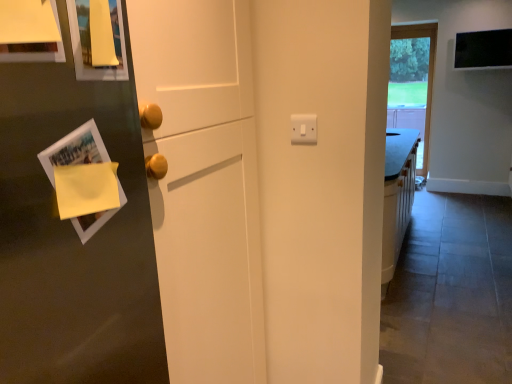
Question: Does yellow paper at left have a lesser width compared to transparent glass window at upper right?

Choices:
 (A) no
 (B) yes

Answer: (A)

Question: From the image's perspective, would you say yellow paper at left is shown under transparent glass window at upper right?

Choices:
 (A) no
 (B) yes

Answer: (B)

Question: Does yellow paper at left have a greater height compared to transparent glass window at upper right?

Choices:
 (A) no
 (B) yes

Answer: (A)

Question: From a real-world perspective, is yellow paper at left located beneath transparent glass window at upper right?

Choices:
 (A) no
 (B) yes

Answer: (A)

Question: From the image's perspective, would you say yellow paper at left is positioned over transparent glass window at upper right?

Choices:
 (A) no
 (B) yes

Answer: (A)

Question: Is there a large distance between yellow paper at left and transparent glass window at upper right?

Choices:
 (A) yes
 (B) no

Answer: (A)

Question: Is transparent glass window at upper right looking in the opposite direction of yellow paper at left?

Choices:
 (A) no
 (B) yes

Answer: (A)

Question: Is transparent glass window at upper right with yellow paper at left?

Choices:
 (A) no
 (B) yes

Answer: (A)

Question: From the image's perspective, is transparent glass window at upper right on top of yellow paper at left?

Choices:
 (A) yes
 (B) no

Answer: (A)

Question: Is transparent glass window at upper right at the left side of yellow paper at left?

Choices:
 (A) yes
 (B) no

Answer: (B)

Question: Considering the relative positions of transparent glass window at upper right and yellow paper at left in the image provided, is transparent glass window at upper right behind yellow paper at left?

Choices:
 (A) no
 (B) yes

Answer: (B)

Question: Can you confirm if transparent glass window at upper right is smaller than yellow paper at left?

Choices:
 (A) yes
 (B) no

Answer: (B)

Question: In terms of size, does yellow paper at left appear bigger or smaller than transparent glass window at upper right?

Choices:
 (A) big
 (B) small

Answer: (B)